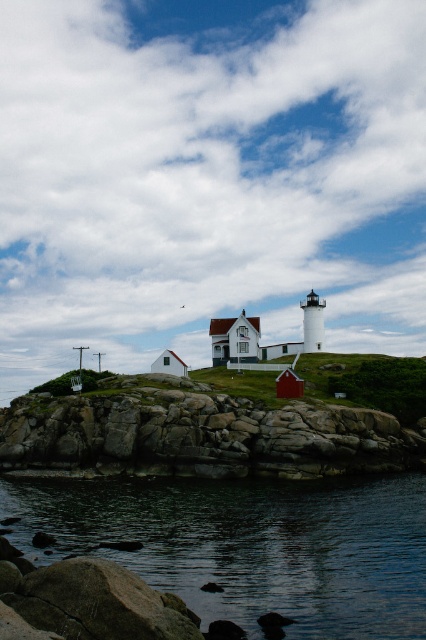
Question: Is dark blue water at lower center to the left of rocky cliff at lower left from the viewer's perspective?

Choices:
 (A) yes
 (B) no

Answer: (B)

Question: Which object is farther from the camera taking this photo?

Choices:
 (A) dark blue water at lower center
 (B) rocky cliff at lower left

Answer: (B)

Question: Does dark blue water at lower center have a smaller size compared to rocky cliff at lower left?

Choices:
 (A) yes
 (B) no

Answer: (A)

Question: Can you confirm if dark blue water at lower center is positioned below rocky cliff at lower left?

Choices:
 (A) no
 (B) yes

Answer: (B)